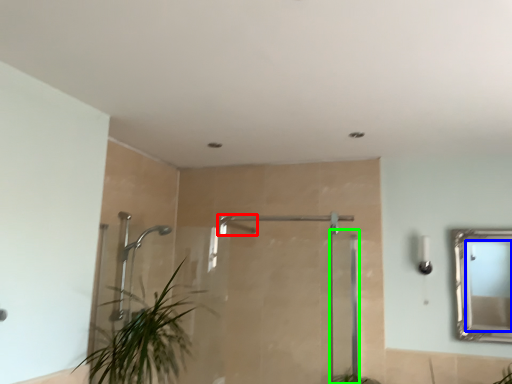
Question: Which object is positioned closest to shower (highlighted by a red box)? Select from mirror (highlighted by a blue box) and screen door (highlighted by a green box).

Choices:
 (A) mirror
 (B) screen door

Answer: (B)